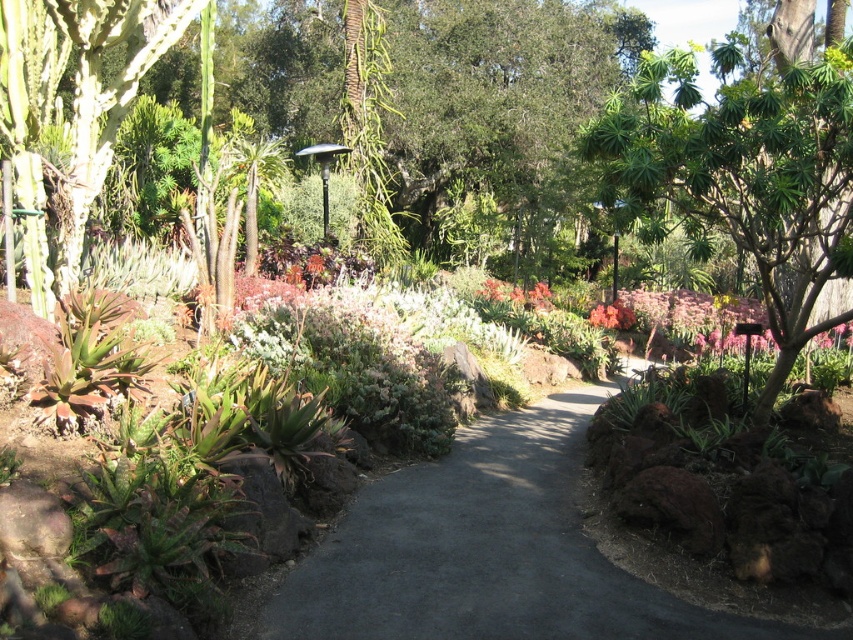
Is dark gray asphalt at center further to the viewer compared to pink matte flower at center?

No.

Who is positioned more to the left, dark gray asphalt at center or pink matte flower at center?

Positioned to the left is dark gray asphalt at center.

This screenshot has width=853, height=640. Describe the element at coordinates (480, 548) in the screenshot. I see `dark gray asphalt at center` at that location.

Where is `dark gray asphalt at center`? This screenshot has height=640, width=853. dark gray asphalt at center is located at coordinates (480, 548).

Looking at this image, how distant is dark gray asphalt at center from green leafy tree at upper right?

dark gray asphalt at center is 5.61 meters from green leafy tree at upper right.

Between dark gray asphalt at center and green leafy tree at upper right, which one appears on the left side from the viewer's perspective?

From the viewer's perspective, dark gray asphalt at center appears more on the left side.

The height and width of the screenshot is (640, 853). Identify the location of dark gray asphalt at center. (480, 548).

Which is more to the right, green leafy tree at upper right or pink matte flower at center?

Positioned to the right is green leafy tree at upper right.

Who is taller, green leafy tree at upper right or pink matte flower at center?

green leafy tree at upper right is taller.

Is point (776, 170) behind point (596, 324)?

No, (776, 170) is in front of (596, 324).

Locate an element on the screen. The image size is (853, 640). green leafy tree at upper right is located at coordinates (747, 170).